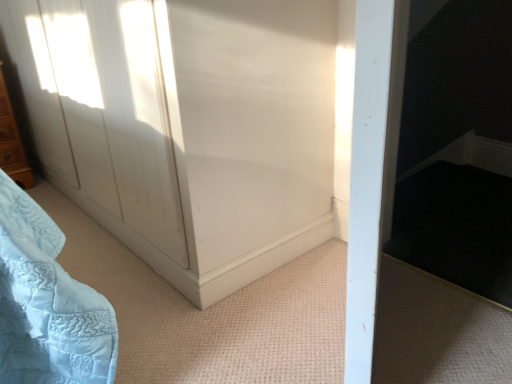
You are a GUI agent. You are given a task and a screenshot of the screen. Output one action in this format:
    pyautogui.click(x=<x>, y=<y>)
    Task: Click on the wooden dresser at left
    The image size is (512, 384).
    Given the screenshot: What is the action you would take?
    pyautogui.click(x=12, y=142)

This screenshot has width=512, height=384. What do you see at coordinates (12, 142) in the screenshot?
I see `wooden dresser at left` at bounding box center [12, 142].

In order to face white glossy door at upper left, should I rotate leftwards or rightwards?

To face it directly, rotate left by 16.779 degrees.

Image resolution: width=512 pixels, height=384 pixels. In order to click on white glossy door at upper left in this screenshot , I will do `click(193, 130)`.

Describe the element at coordinates (193, 130) in the screenshot. Image resolution: width=512 pixels, height=384 pixels. I see `white glossy door at upper left` at that location.

Where is `wooden dresser at left`? This screenshot has height=384, width=512. wooden dresser at left is located at coordinates (12, 142).

Considering the relative positions of wooden dresser at left and white glossy door at upper left in the image provided, is wooden dresser at left to the left or to the right of white glossy door at upper left?

wooden dresser at left is positioned on white glossy door at upper left's left side.

Is wooden dresser at left positioned in front of white glossy door at upper left?

No, wooden dresser at left is further to the viewer.

Considering the positions of point (4, 106) and point (110, 48), is point (4, 106) closer or farther from the camera than point (110, 48)?

Point (4, 106) is farther from the camera than point (110, 48).

From the image's perspective, is wooden dresser at left located above or below white glossy door at upper left?

From the image's perspective, wooden dresser at left appears below white glossy door at upper left.

From a real-world perspective, is wooden dresser at left above or below white glossy door at upper left?

wooden dresser at left is below white glossy door at upper left.

Which of these two, wooden dresser at left or white glossy door at upper left, is wider?

With larger width is white glossy door at upper left.

Does wooden dresser at left have a greater height compared to white glossy door at upper left?

No, wooden dresser at left is not taller than white glossy door at upper left.

In the scene shown: Which of these two, wooden dresser at left or white glossy door at upper left, is bigger?

With larger size is white glossy door at upper left.

Would you say wooden dresser at left is outside white glossy door at upper left?

Yes, wooden dresser at left is not within white glossy door at upper left.

Is wooden dresser at left not close to white glossy door at upper left?

Yes.

Is white glossy door at upper left at the back of wooden dresser at left?

No, wooden dresser at left is not facing away from white glossy door at upper left.

What's the angular difference between wooden dresser at left and white glossy door at upper left's facing directions?

The angular difference between wooden dresser at left and white glossy door at upper left is 90.7 degrees.

I want to click on screen door above the wooden dresser at left (from a real-world perspective), so click(x=193, y=130).

Which object is positioned more to the right, white glossy door at upper left or wooden dresser at left?

From the viewer's perspective, white glossy door at upper left appears more on the right side.

Does white glossy door at upper left lie in front of wooden dresser at left?

Yes, the depth of white glossy door at upper left is less than that of wooden dresser at left.

Is point (233, 252) closer or farther from the camera than point (1, 130)?

Point (233, 252) is closer to the camera than point (1, 130).

From the image's perspective, is white glossy door at upper left located above or below wooden dresser at left?

From the image's perspective, white glossy door at upper left appears above wooden dresser at left.

From a real-world perspective, is white glossy door at upper left on wooden dresser at left?

Indeed, from a real-world perspective, white glossy door at upper left stands above wooden dresser at left.

Based on the photo, can you confirm if white glossy door at upper left is thinner than wooden dresser at left?

No.

Based on the photo, which of these two, white glossy door at upper left or wooden dresser at left, stands shorter?

A: With less height is wooden dresser at left.

Is white glossy door at upper left smaller than wooden dresser at left?

No, white glossy door at upper left is not smaller than wooden dresser at left.

Do you think white glossy door at upper left is within wooden dresser at left, or outside of it?

white glossy door at upper left is spatially situated outside wooden dresser at left.

Is white glossy door at upper left far from wooden dresser at left?

Absolutely, white glossy door at upper left is distant from wooden dresser at left.

Is white glossy door at upper left oriented away from wooden dresser at left?

That's not correct — white glossy door at upper left is not looking away from wooden dresser at left.

How much distance is there between white glossy door at upper left and wooden dresser at left?

The distance of white glossy door at upper left from wooden dresser at left is 4.42 feet.

What are the coordinates of `furniture behind the white glossy door at upper left` in the screenshot? It's located at pyautogui.click(x=12, y=142).

You are a GUI agent. You are given a task and a screenshot of the screen. Output one action in this format:
    pyautogui.click(x=<x>, y=<y>)
    Task: Click on the screen door that appears in front of the wooden dresser at left
    Image resolution: width=512 pixels, height=384 pixels.
    Given the screenshot: What is the action you would take?
    pyautogui.click(x=193, y=130)

In order to click on furniture to the left of white glossy door at upper left in this screenshot , I will do `click(12, 142)`.